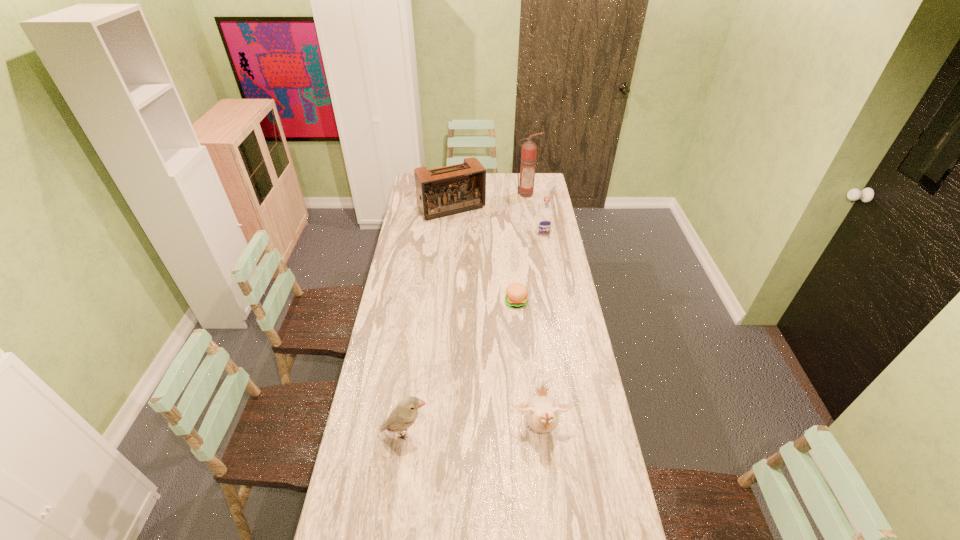
I want to click on free space at the left edge of the desktop, so click(x=401, y=345).

Identify the location of vacant space at the right edge. The image size is (960, 540). (541, 194).

The width and height of the screenshot is (960, 540). What are the coordinates of `free area in between the tallest object and the hamburger` in the screenshot? It's located at (521, 248).

I want to click on free area in between the vodka and the radio receiver, so click(497, 220).

You are a GUI agent. You are given a task and a screenshot of the screen. Output one action in this format:
    pyautogui.click(x=<x>, y=<y>)
    Task: Click on the empty space between the vodka and the radio receiver
    This screenshot has width=960, height=540.
    Given the screenshot: What is the action you would take?
    pyautogui.click(x=497, y=220)

Find the location of `vacant region between the second tallest object and the fire extinguisher`. vacant region between the second tallest object and the fire extinguisher is located at coordinates (489, 201).

I want to click on free area in between the third nearest object and the fire extinguisher, so click(x=521, y=248).

This screenshot has height=540, width=960. I want to click on vacant area that lies between the right bird and the tallest object, so click(533, 311).

Identify the location of vacant point located between the left bird and the fifth shortest object. The width and height of the screenshot is (960, 540). (429, 320).

Locate an element on the screen. empty space that is in between the second tallest object and the right bird is located at coordinates click(496, 318).